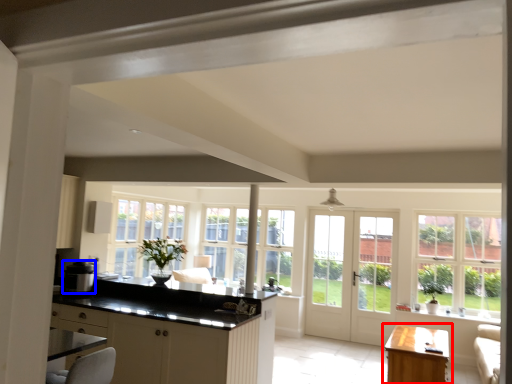
Question: Which object appears farthest to the camera in this image, table (highlighted by a red box) or appliance (highlighted by a blue box)?

Choices:
 (A) table
 (B) appliance

Answer: (B)